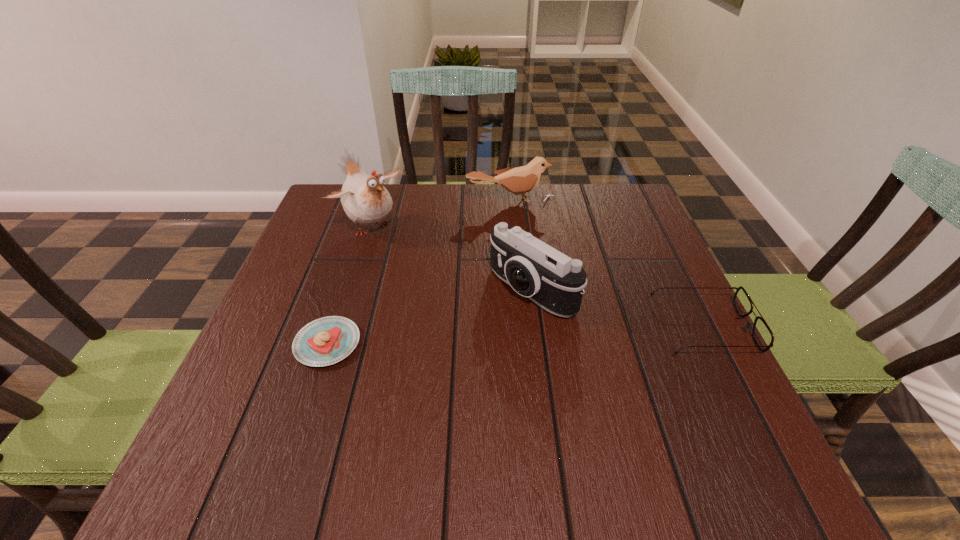
This screenshot has width=960, height=540. Find the location of `free space on the desktop that is between the shortest object and the rightmost object and is positioned at the beak of the tallest object`. free space on the desktop that is between the shortest object and the rightmost object and is positioned at the beak of the tallest object is located at coordinates (490, 337).

In order to click on vacant spot on the desktop that is between the pastry and the rightmost object and is positioned on the front lens of the camera in this screenshot , I will do `click(464, 338)`.

The height and width of the screenshot is (540, 960). I want to click on free spot on the desktop that is between the pastry and the rightmost object and is positioned at the beak of the right bird, so click(566, 334).